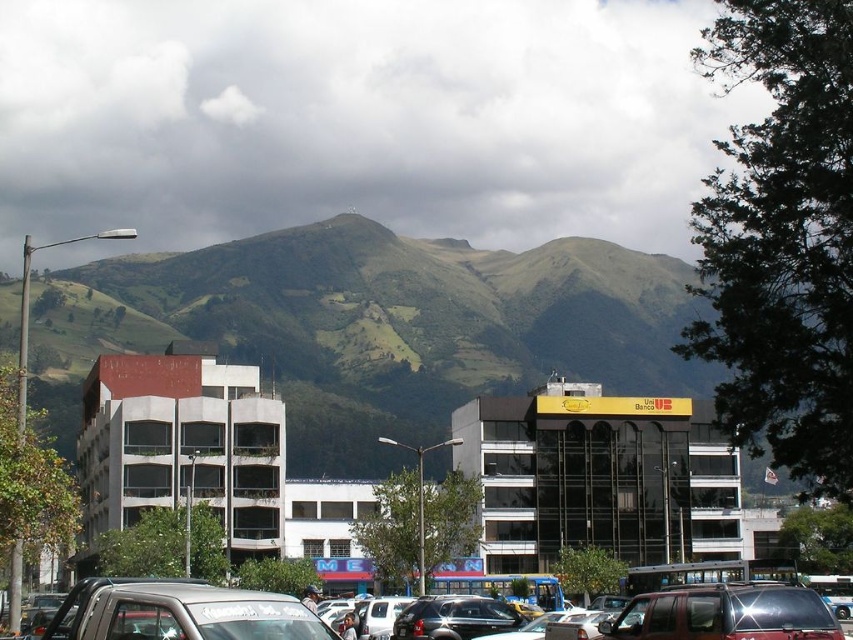
Can you confirm if green grassy mountain at upper center is thinner than silver metallic pickup truck at lower left?

No, green grassy mountain at upper center is not thinner than silver metallic pickup truck at lower left.

From the picture: Who is shorter, green grassy mountain at upper center or silver metallic pickup truck at lower left?

silver metallic pickup truck at lower left

Where is `green grassy mountain at upper center`? green grassy mountain at upper center is located at coordinates (378, 324).

At what (x,y) coordinates should I click in order to perform the action: click on silver metallic pickup truck at lower left. Please return your answer as a coordinate pair (x, y). This screenshot has width=853, height=640. Looking at the image, I should click on (178, 611).

Who is more forward, (129, 628) or (438, 627)?

Point (129, 628)

Find the location of a particular element. silver metallic pickup truck at lower left is located at coordinates (178, 611).

From the picture: Can you confirm if metallic silver suv at center is thinner than shiny black car at center?

Correct, metallic silver suv at center's width is less than shiny black car at center's.

What are the coordinates of `metallic silver suv at center` in the screenshot? It's located at (724, 612).

At what (x,y) coordinates should I click in order to perform the action: click on metallic silver suv at center. Please return your answer as a coordinate pair (x, y). Image resolution: width=853 pixels, height=640 pixels. Looking at the image, I should click on (724, 612).